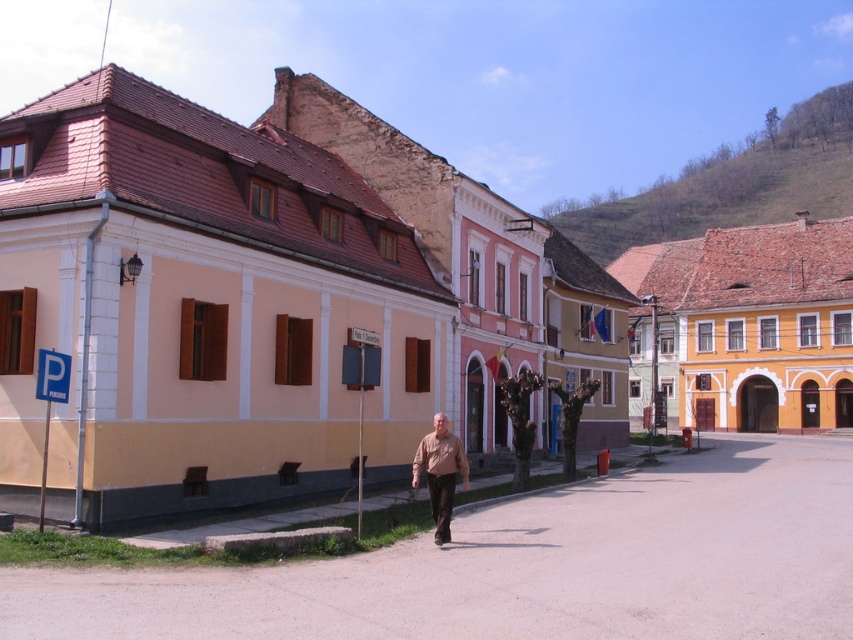
Question: Does matte pink building at center appear on the right side of brown matte shirt at center?

Choices:
 (A) yes
 (B) no

Answer: (A)

Question: Is matte pink building at center to the right of brown matte shirt at center from the viewer's perspective?

Choices:
 (A) yes
 (B) no

Answer: (A)

Question: Which point is farther to the camera?

Choices:
 (A) brown matte shirt at center
 (B) matte pink building at center

Answer: (B)

Question: Can you confirm if matte pink building at center is thinner than brown matte shirt at center?

Choices:
 (A) no
 (B) yes

Answer: (A)